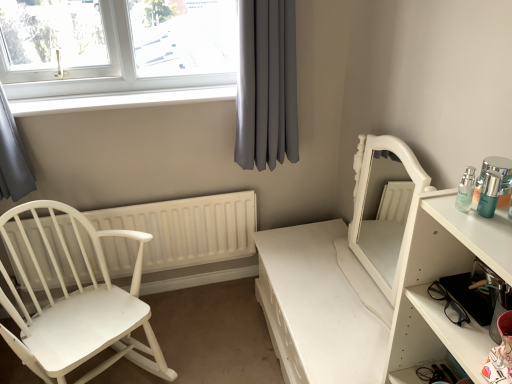
Where is `free point to the left of white glossy mirror at right`? The image size is (512, 384). free point to the left of white glossy mirror at right is located at coordinates (310, 274).